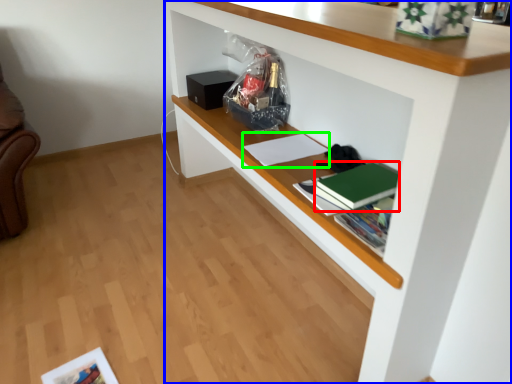
Question: Which object is positioned farthest from paperback book (highlighted by a red box)? Select from shelf (highlighted by a blue box) and book (highlighted by a green box).

Choices:
 (A) shelf
 (B) book

Answer: (B)